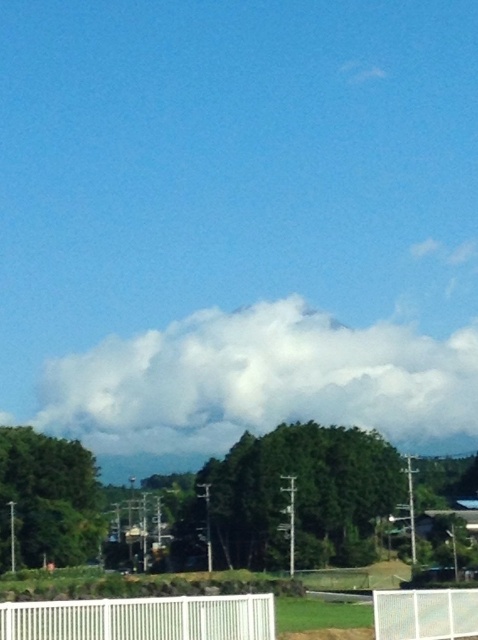
Question: Which point is farther from the camera taking this photo?

Choices:
 (A) (381, 595)
 (B) (249, 632)

Answer: (A)

Question: Can you confirm if white plastic fence at lower center is smaller than white mesh fence at lower center?

Choices:
 (A) yes
 (B) no

Answer: (A)

Question: Is the position of white plastic fence at lower center less distant than that of white mesh fence at lower center?

Choices:
 (A) no
 (B) yes

Answer: (B)

Question: Among these objects, which one is farthest from the camera?

Choices:
 (A) white mesh fence at lower center
 (B) white plastic fence at lower center

Answer: (A)

Question: Which of the following is the farthest from the observer?

Choices:
 (A) (445, 627)
 (B) (126, 636)

Answer: (A)

Question: Can you confirm if white plastic fence at lower center is positioned below white mesh fence at lower center?

Choices:
 (A) yes
 (B) no

Answer: (B)